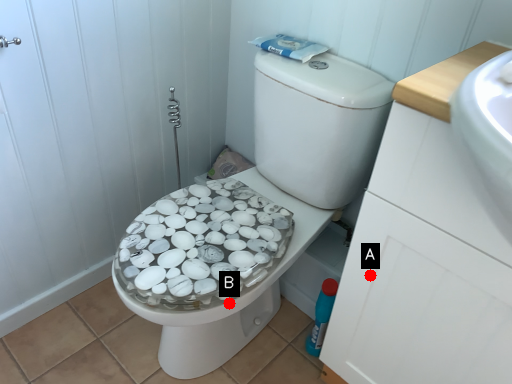
Question: Two points are circled on the image, labeled by A and B beside each circle. Which point appears farthest from the camera in this image?

Choices:
 (A) A is further
 (B) B is further

Answer: (B)